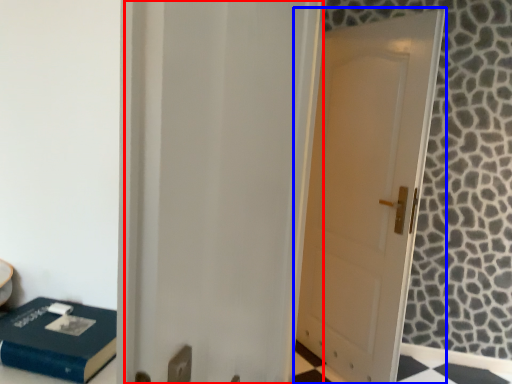
Question: Which of the following is the closest to the observer, screen door (highlighted by a red box) or door (highlighted by a blue box)?

Choices:
 (A) screen door
 (B) door

Answer: (A)